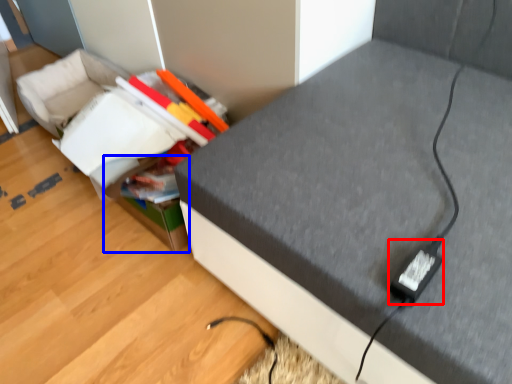
Question: Which of the following is the closest to the observer, plug (highlighted by a red box) or storage box (highlighted by a blue box)?

Choices:
 (A) plug
 (B) storage box

Answer: (A)